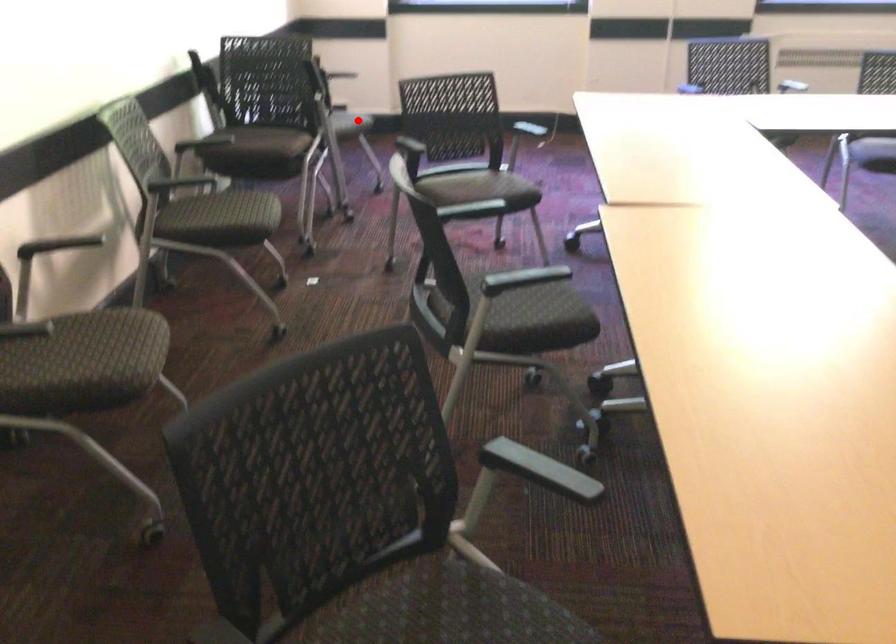
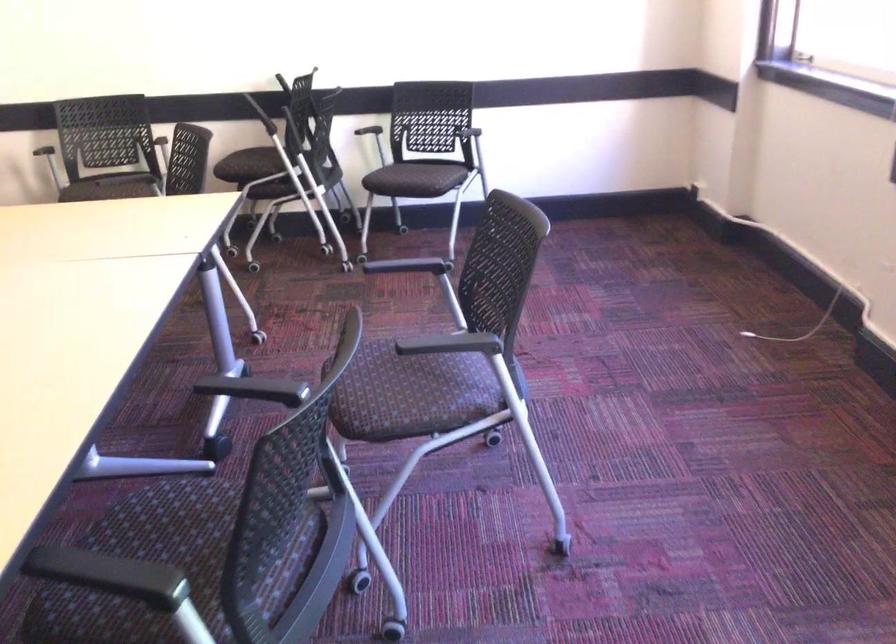
Question: I am providing you with two images of the same scene from different viewpoints. Image1 has a red point marked. In image2, the corresponding 3D location appears at what relative position? Reply with the corresponding letter.

Choices:
 (A) Closer
 (B) Farther

Answer: (A)